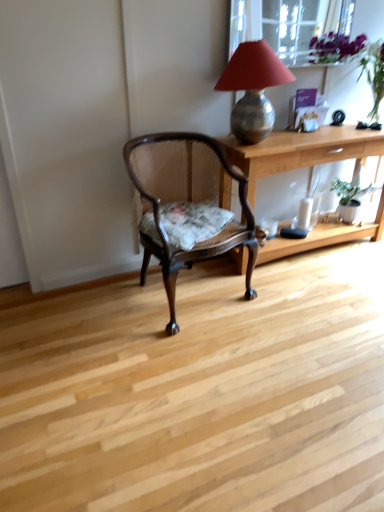
At what (x,y) coordinates should I click in order to perform the action: click on free spot to the left of mahogany cane chair at center. Please return your answer as a coordinate pair (x, y). Looking at the image, I should click on (85, 312).